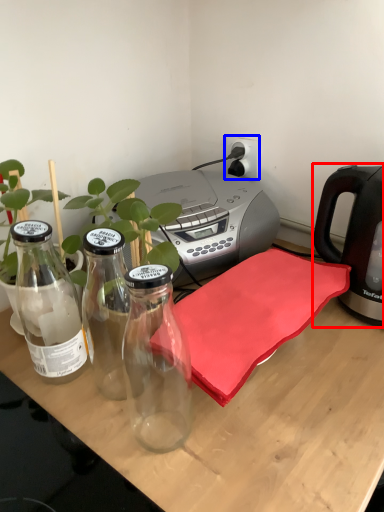
Question: Which point is closer to the camera, kettle (highlighted by a red box) or electric outlet (highlighted by a blue box)?

Choices:
 (A) kettle
 (B) electric outlet

Answer: (A)